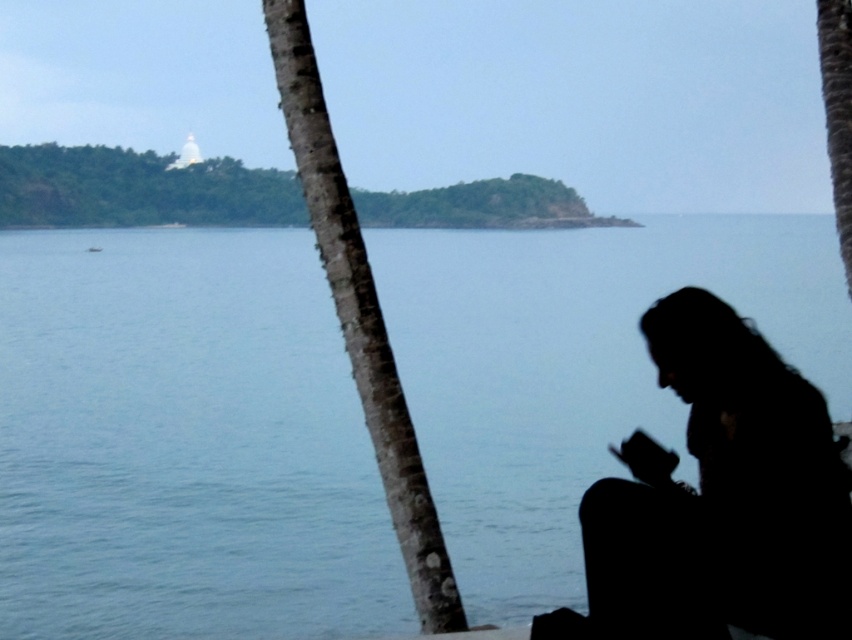
Can you confirm if blue water at center is smaller than silhouette hair at lower right?

No, blue water at center is not smaller than silhouette hair at lower right.

Who is more forward, (220, 598) or (757, 516)?

Point (757, 516)

Find the location of a particular element. The image size is (852, 640). blue water at center is located at coordinates click(x=183, y=442).

Who is taller, silhouette hair at lower right or brown rough bark palm tree at center-left?

brown rough bark palm tree at center-left is taller.

What do you see at coordinates (726, 490) in the screenshot? I see `silhouette hair at lower right` at bounding box center [726, 490].

Looking at this image, who is more distant from viewer, [789,506] or [327,120]?

Positioned behind is point [327,120].

This screenshot has height=640, width=852. I want to click on silhouette hair at lower right, so click(726, 490).

Is point (153, 420) closer to camera compared to point (429, 577)?

No, it is behind (429, 577).

Is blue water at center bigger than brown rough bark palm tree at center-left?

Correct, blue water at center is larger in size than brown rough bark palm tree at center-left.

What do you see at coordinates (183, 442) in the screenshot?
I see `blue water at center` at bounding box center [183, 442].

The height and width of the screenshot is (640, 852). What are the coordinates of `blue water at center` in the screenshot? It's located at (183, 442).